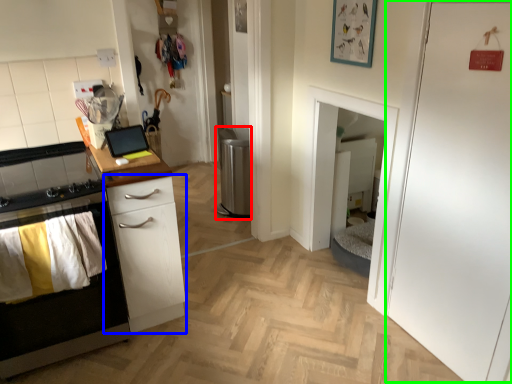
Question: Which object is positioned closest to appliance (highlighted by a red box)? Select from chest of drawers (highlighted by a blue box) and door (highlighted by a green box).

Choices:
 (A) chest of drawers
 (B) door

Answer: (A)